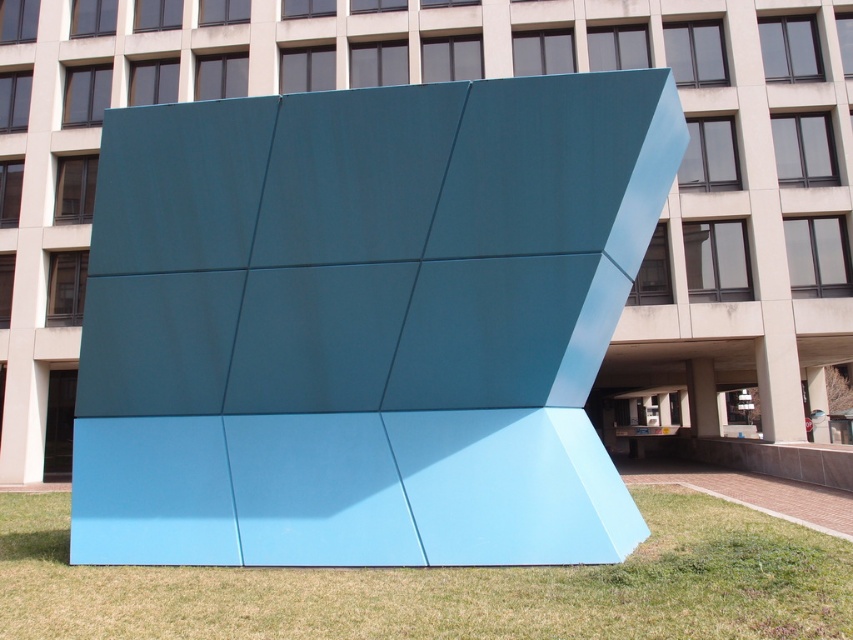
Does teal matte sculpture at center appear on the left side of green grass at lower center?

Correct, you'll find teal matte sculpture at center to the left of green grass at lower center.

Does point (328, 449) come closer to viewer compared to point (692, 577)?

That is False.

In order to click on teal matte sculpture at center in this screenshot , I will do `click(364, 323)`.